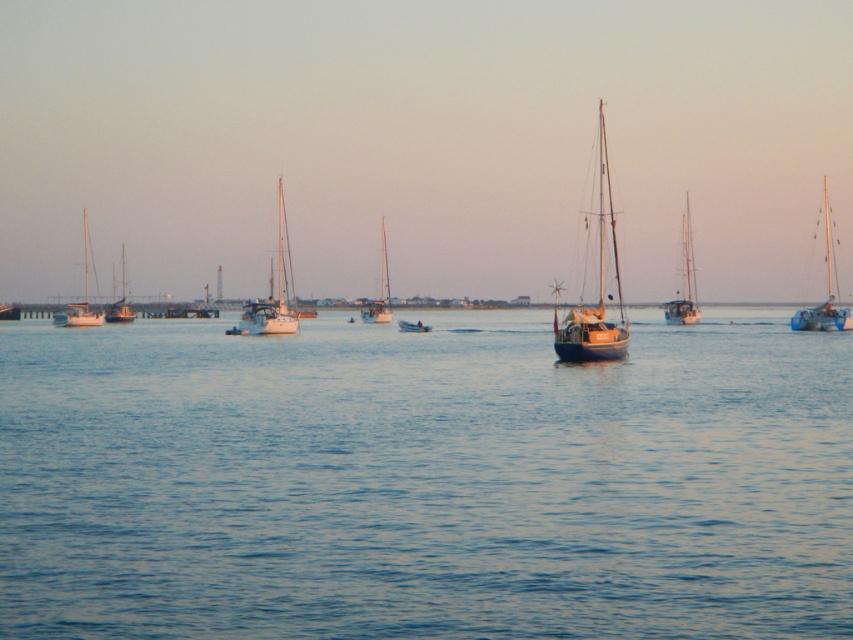
Question: Is blue matte sailboat at center closer to camera compared to matte white sailboat at left?

Choices:
 (A) no
 (B) yes

Answer: (B)

Question: Which point appears closest to the camera in this image?

Choices:
 (A) (373, 500)
 (B) (120, 310)
 (C) (84, 252)

Answer: (A)

Question: Which point is closer to the camera taking this photo?

Choices:
 (A) (691, 298)
 (B) (77, 301)
 (C) (428, 326)
 (D) (137, 632)

Answer: (D)

Question: Can you confirm if blue wooden sailboat at right is wider than wooden sailboat at right?

Choices:
 (A) no
 (B) yes

Answer: (B)

Question: In this image, where is white matte sailboat at center located relative to wooden sailboat at center?

Choices:
 (A) above
 (B) below

Answer: (A)

Question: Which of these objects is positioned farthest from the blue matte sailboat at center?

Choices:
 (A) metallic blue dinghy at center
 (B) blue wooden sailboat at right

Answer: (A)